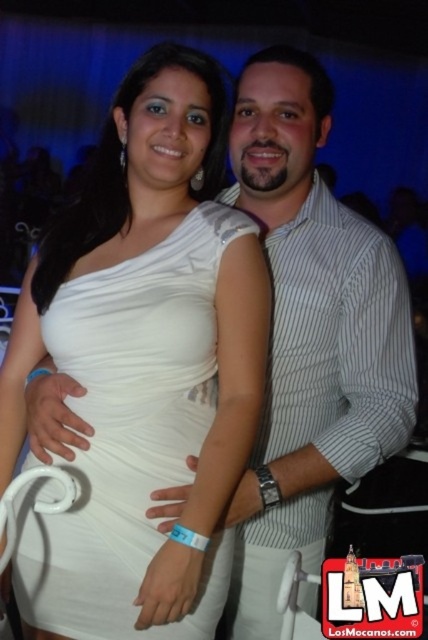
Does white striped shirt at center appear on the right side of white satin dress at center?

Indeed, white striped shirt at center is positioned on the right side of white satin dress at center.

Is point (269, 227) positioned behind point (95, 560)?

That is True.

Locate an element on the screen. white striped shirt at center is located at coordinates (309, 333).